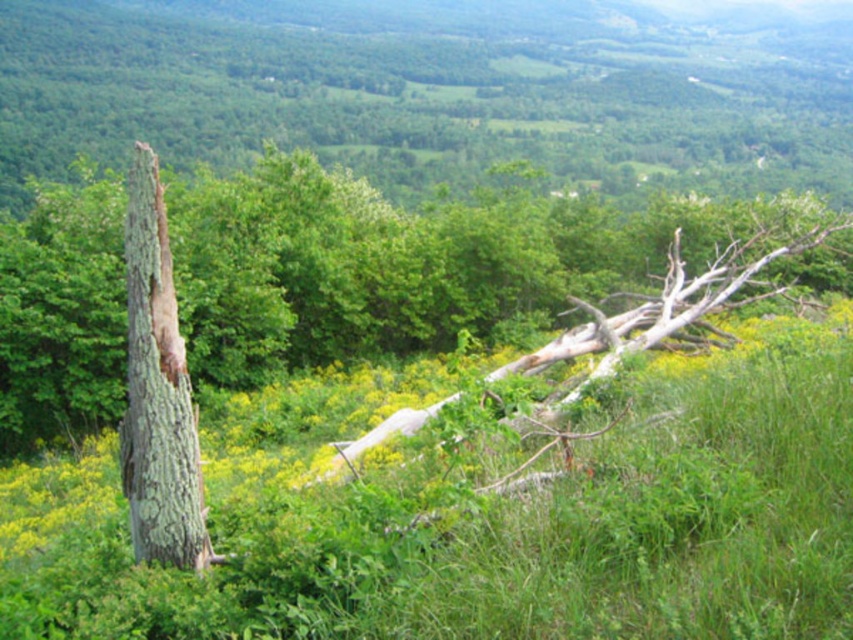
Where is `smooth bark tree trunk at left`? smooth bark tree trunk at left is located at coordinates pos(402,264).

From the picture: Can you confirm if smooth bark tree trunk at left is positioned to the right of greenish-brown bark tree trunk at left?

In fact, smooth bark tree trunk at left is to the left of greenish-brown bark tree trunk at left.

Which is behind, point (326, 333) or point (183, 538)?

The point (326, 333) is more distant.

This screenshot has width=853, height=640. What are the coordinates of `smooth bark tree trunk at left` in the screenshot? It's located at (402, 264).

Does green grassy at center appear on the right side of greenish-brown bark tree trunk at left?

Correct, you'll find green grassy at center to the right of greenish-brown bark tree trunk at left.

Is point (416, 550) behind point (184, 444)?

No, it is not.

Image resolution: width=853 pixels, height=640 pixels. I want to click on green grassy at center, so click(485, 515).

Between point (76, 625) and point (260, 321), which one is positioned behind?

The point (260, 321) is more distant.

Can you confirm if green grassy at center is bigger than smooth bark tree trunk at left?

Incorrect, green grassy at center is not larger than smooth bark tree trunk at left.

This screenshot has width=853, height=640. What do you see at coordinates (485, 515) in the screenshot? I see `green grassy at center` at bounding box center [485, 515].

I want to click on green grassy at center, so click(485, 515).